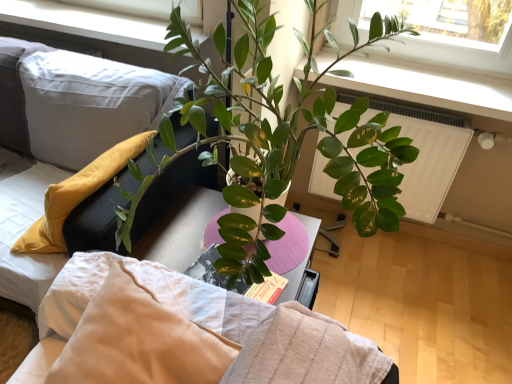
Question: From a real-world perspective, is soft white fabric couch at left on top of white textured bed at center?

Choices:
 (A) no
 (B) yes

Answer: (A)

Question: From the image's perspective, is soft white fabric couch at left below white textured bed at center?

Choices:
 (A) no
 (B) yes

Answer: (B)

Question: Is soft white fabric couch at left positioned beyond the bounds of white textured bed at center?

Choices:
 (A) yes
 (B) no

Answer: (A)

Question: Is soft white fabric couch at left oriented away from white textured bed at center?

Choices:
 (A) yes
 (B) no

Answer: (B)

Question: Is white textured bed at center completely or partially inside soft white fabric couch at left?

Choices:
 (A) no
 (B) yes

Answer: (A)

Question: Is soft white fabric couch at left bigger than white textured bed at center?

Choices:
 (A) yes
 (B) no

Answer: (A)

Question: Considering the relative positions of white textured bed at center and white textured pillow at upper left in the image provided, is white textured bed at center in front of white textured pillow at upper left?

Choices:
 (A) no
 (B) yes

Answer: (B)

Question: Is white textured bed at center positioned far away from white textured pillow at upper left?

Choices:
 (A) yes
 (B) no

Answer: (B)

Question: From the image's perspective, is white textured bed at center located beneath white textured pillow at upper left?

Choices:
 (A) no
 (B) yes

Answer: (A)

Question: Is white textured pillow at upper left at the back of white textured bed at center?

Choices:
 (A) yes
 (B) no

Answer: (B)

Question: Is white textured bed at center to the right of white textured pillow at upper left from the viewer's perspective?

Choices:
 (A) no
 (B) yes

Answer: (B)

Question: Is white textured bed at center completely or partially outside of white textured pillow at upper left?

Choices:
 (A) no
 (B) yes

Answer: (B)

Question: From the image's perspective, is white textured pillow at upper left below soft white fabric couch at left?

Choices:
 (A) no
 (B) yes

Answer: (B)